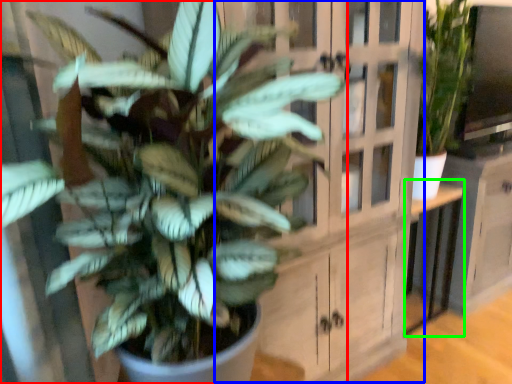
Question: Which is farther away from houseplant (highlighted by a red box)? dresser (highlighted by a blue box) or table (highlighted by a green box)?

Choices:
 (A) dresser
 (B) table

Answer: (B)